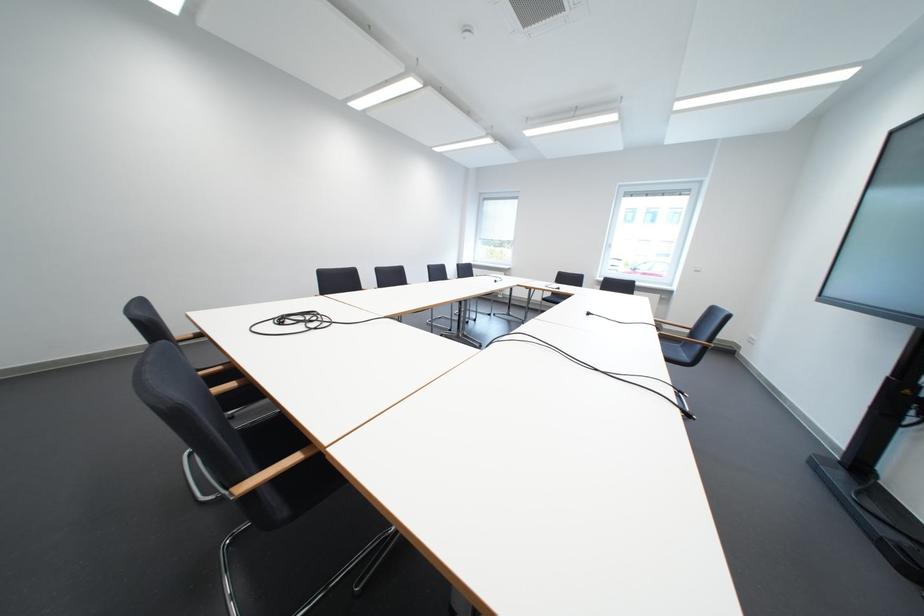
Find the location of `white power outlet`. white power outlet is located at coordinates (749, 339).